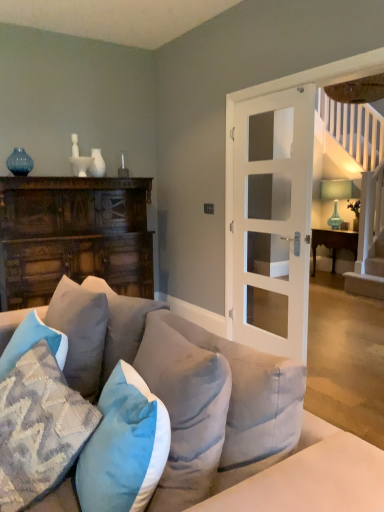
Identify the location of free spot above white glass door at center (from a real-world perspective). This screenshot has width=384, height=512. (273, 91).